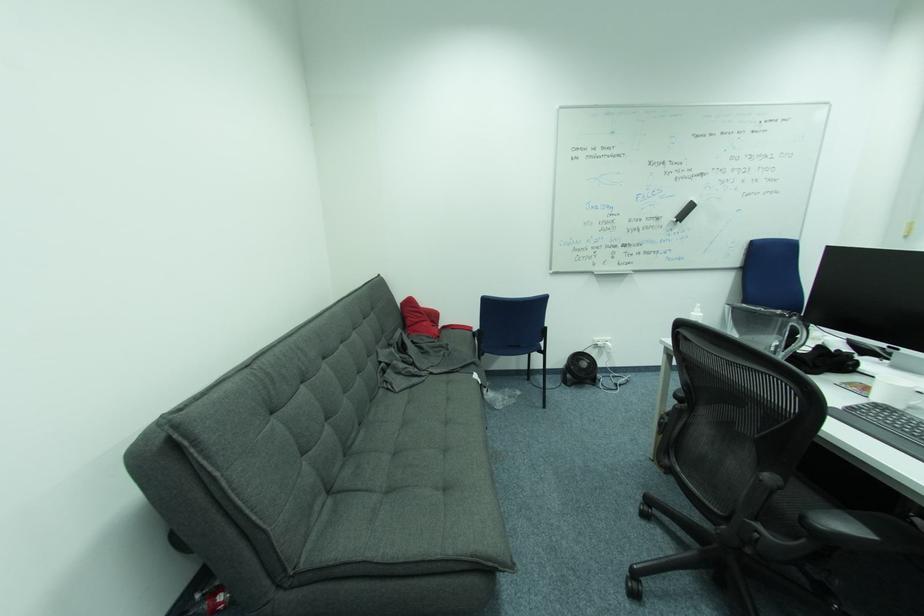
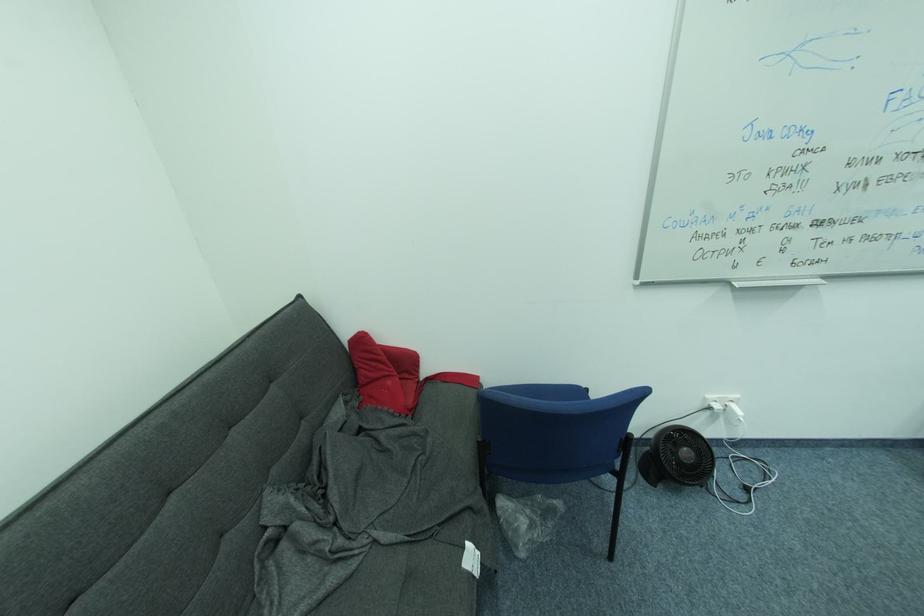
The point at (569, 386) is marked in the first image. Where is the corresponding point in the second image?

(648, 479)